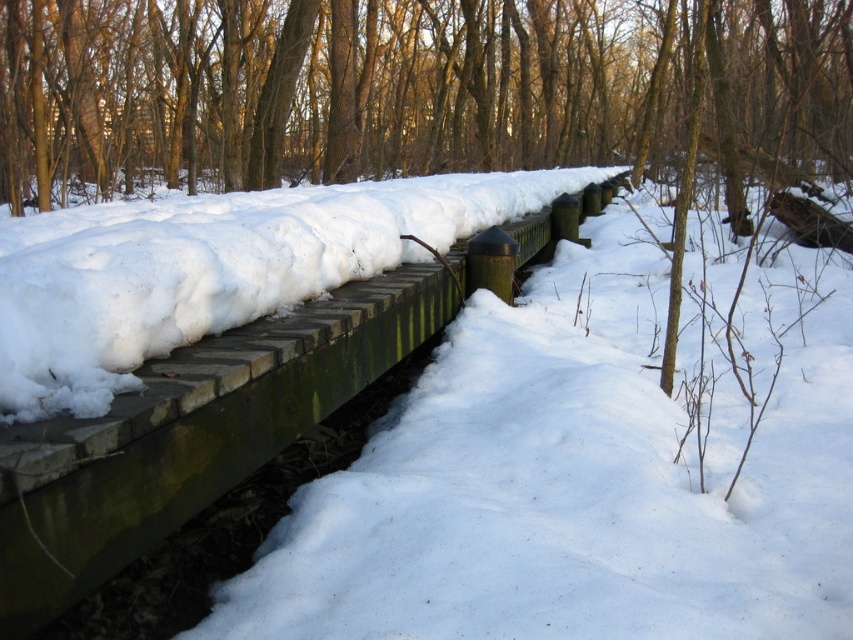
You are a bird flying over the winter scene and want to land on the highest point between the brown wood tree at upper center and the green wood rail at center. Which one should you choose?

The brown wood tree at upper center has a greater height compared to the green wood rail at center, so you should choose the brown wood tree at upper center to land on the highest point.

You are an architect designing a winter landscape model. You have a brown wood tree at upper center and a green wood rail at center in your design. Which object has a greater width in the image?

The brown wood tree at upper center has a greater width than the green wood rail at center.

You are a photographer standing on the wooden bridge and want to take a photo that includes both the brown wood tree at upper center and the green wood rail at center. Which object will appear closer to the camera in the photo?

The brown wood tree at upper center will appear closer to the camera because it is in front of the green wood rail at center.